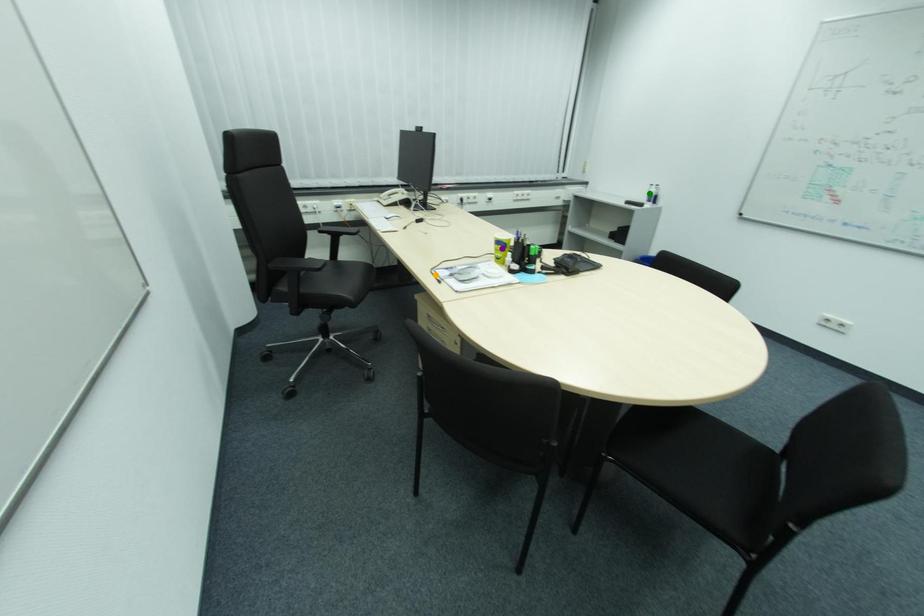
Order these from nearest to farthest:
purple point, orange point, green point

orange point < purple point < green point